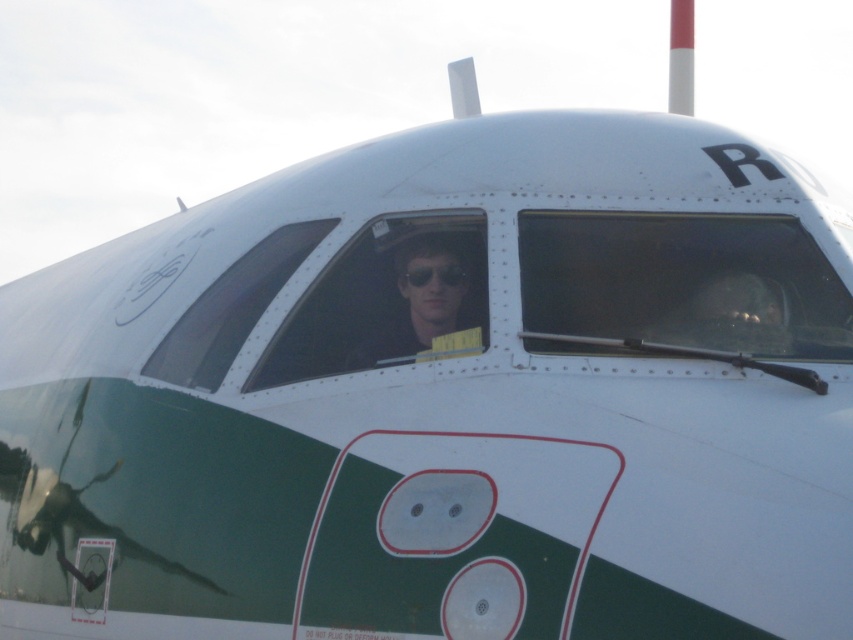
Question: Can you confirm if black matte goggles at center is wider than matte black nose at center?

Choices:
 (A) yes
 (B) no

Answer: (A)

Question: Among these points, which one is nearest to the camera?

Choices:
 (A) (453, 284)
 (B) (460, 268)

Answer: (A)

Question: Which of the following is the farthest from the observer?

Choices:
 (A) (405, 278)
 (B) (440, 280)
 (C) (480, 330)

Answer: (A)

Question: Does matte black sunglasses at center appear on the left side of black matte goggles at center?

Choices:
 (A) yes
 (B) no

Answer: (A)

Question: Where is matte black sunglasses at center located in relation to matte black nose at center in the image?

Choices:
 (A) above
 (B) below

Answer: (B)

Question: Which object is closer to the camera taking this photo?

Choices:
 (A) black matte goggles at center
 (B) matte black nose at center
 (C) matte black sunglasses at center

Answer: (C)